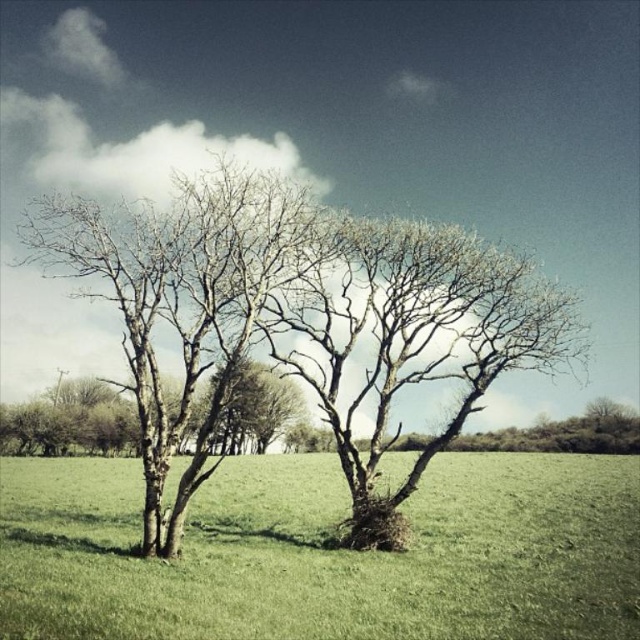
Question: Which object appears closest to the camera in this image?

Choices:
 (A) bare branches at center
 (B) green grass at center
 (C) bare bark tree at center

Answer: (B)

Question: Estimate the real-world distances between objects in this image. Which object is closer to the bare bark tree at center?

Choices:
 (A) bare branches at center
 (B) green grass at center

Answer: (A)

Question: Can you confirm if green grass at center is positioned to the right of bare bark tree at center?

Choices:
 (A) yes
 (B) no

Answer: (A)

Question: Is bare bark tree at center positioned behind bare branches at center?

Choices:
 (A) yes
 (B) no

Answer: (B)

Question: Which of the following is the closest to the observer?

Choices:
 (A) green grass at center
 (B) bare bark tree at center

Answer: (A)

Question: Does green grass at center appear under bare branches at center?

Choices:
 (A) yes
 (B) no

Answer: (A)